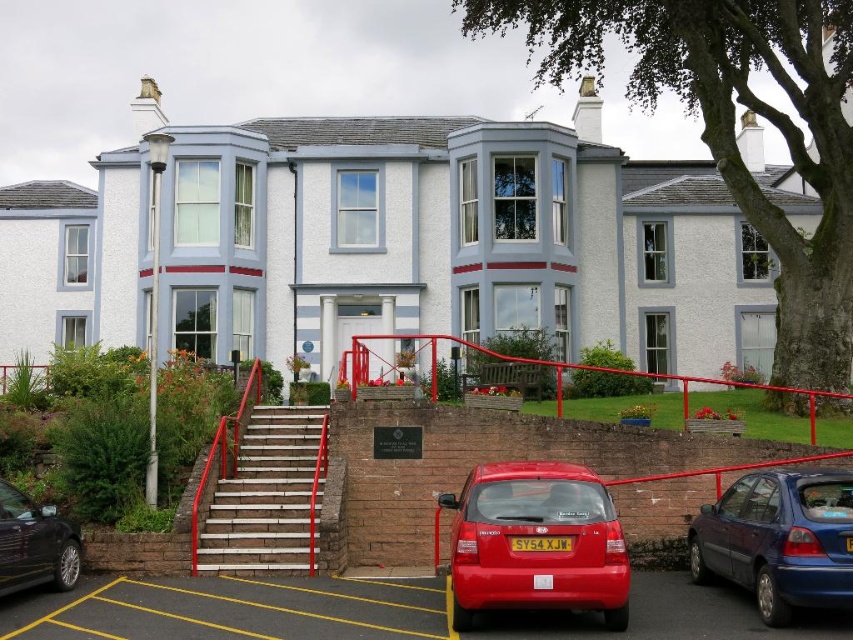
Does white concrete stairs at center have a greater width compared to shiny black sedan at lower left?

Yes.

Does white concrete stairs at center have a lesser width compared to shiny black sedan at lower left?

Incorrect, white concrete stairs at center's width is not less than shiny black sedan at lower left's.

Is point (252, 525) positioned before point (9, 497)?

No, (252, 525) is behind (9, 497).

Locate an element on the screen. This screenshot has height=640, width=853. white concrete stairs at center is located at coordinates (265, 497).

Which is behind, point (199, 608) or point (730, 556)?

The point (199, 608) is more distant.

Is yellow painted asphalt at lower center further to camera compared to metallic blue hatchback at lower right?

Yes, it is.

Does point (280, 612) come closer to viewer compared to point (763, 490)?

No.

Find the location of a particular element. Image resolution: width=853 pixels, height=640 pixels. yellow painted asphalt at lower center is located at coordinates (231, 611).

Is metallic blue hatchback at lower right positioned before shiny black sedan at lower left?

That is True.

Does metallic blue hatchback at lower right have a lesser height compared to shiny black sedan at lower left?

No, metallic blue hatchback at lower right is not shorter than shiny black sedan at lower left.

Is point (844, 557) in front of point (7, 589)?

Yes, point (844, 557) is closer to viewer.

This screenshot has height=640, width=853. I want to click on metallic blue hatchback at lower right, so click(779, 540).